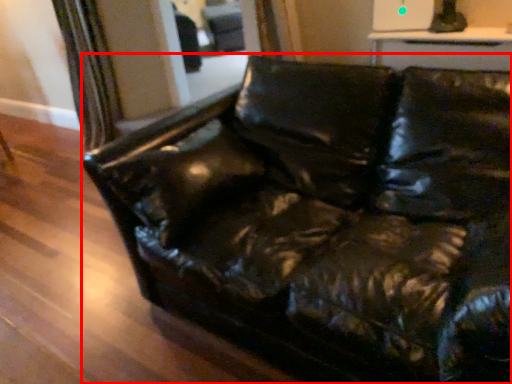
Question: From the image's perspective, what is the correct spatial relationship of studio couch (annotated by the red box) in relation to swivel chair?

Choices:
 (A) above
 (B) below

Answer: (B)